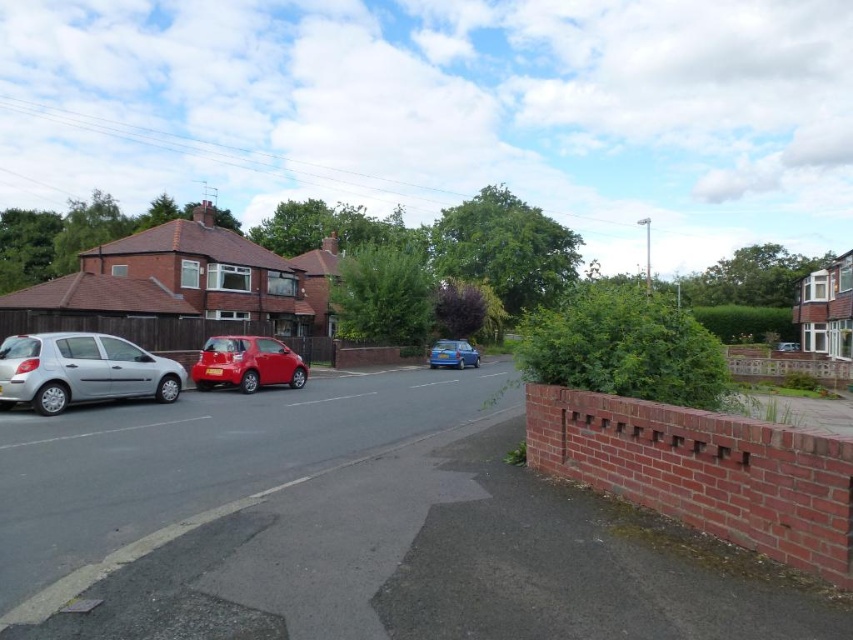
Is point (65, 385) farther from camera compared to point (473, 356)?

No, it is in front of (473, 356).

Is silver metallic car at left to the left of blue metallic hatchback at center from the viewer's perspective?

Yes, silver metallic car at left is to the left of blue metallic hatchback at center.

Is point (102, 392) positioned behind point (428, 353)?

No, it is in front of (428, 353).

Locate an element on the screen. silver metallic car at left is located at coordinates (80, 371).

Where is `shiny red car at center`? The image size is (853, 640). shiny red car at center is located at coordinates (247, 364).

Does shiny red car at center have a lesser height compared to blue metallic hatchback at center?

No, shiny red car at center is not shorter than blue metallic hatchback at center.

This screenshot has width=853, height=640. In order to click on shiny red car at center in this screenshot , I will do `click(247, 364)`.

Between silver metallic car at left and shiny red car at center, which one has less height?

shiny red car at center is shorter.

Between point (35, 333) and point (273, 360), which one is positioned behind?

The point (273, 360) is more distant.

Between point (103, 365) and point (241, 337), which one is positioned in front?

Point (103, 365)

You are a GUI agent. You are given a task and a screenshot of the screen. Output one action in this format:
    pyautogui.click(x=<x>, y=<y>)
    Task: Click on the silver metallic car at left
    
    Given the screenshot: What is the action you would take?
    pyautogui.click(x=80, y=371)